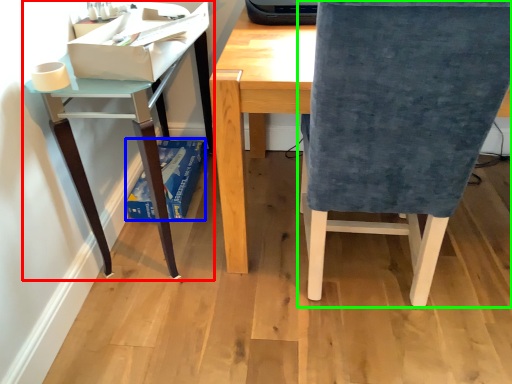
Question: Considering the real-world distances, which object is closest to table (highlighted by a red box)? paperback book (highlighted by a blue box) or chair (highlighted by a green box).

Choices:
 (A) paperback book
 (B) chair

Answer: (A)